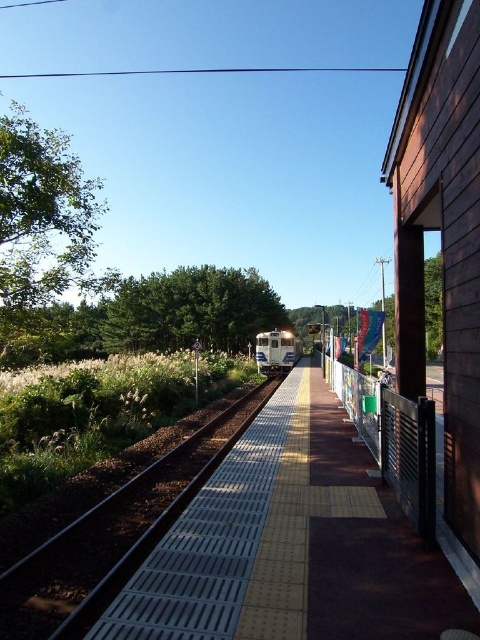
Between metallic silver train track at center and blue glossy train at center, which one has more height?

With more height is blue glossy train at center.

Who is more distant from viewer, (156, 506) or (262, 365)?

The point (262, 365) is behind.

Between point (187, 467) and point (284, 337), which one is positioned behind?

Point (284, 337)

Locate an element on the screen. The width and height of the screenshot is (480, 640). metallic silver train track at center is located at coordinates (115, 532).

Does point (253, 424) lie behind point (23, 630)?

That is True.

Who is shorter, yellow textured platform at center or metallic silver train track at center?

With less height is yellow textured platform at center.

Where is `yellow textured platform at center`? This screenshot has height=640, width=480. yellow textured platform at center is located at coordinates (290, 544).

Can you confirm if yellow textured platform at center is bigger than blue glossy train at center?

Actually, yellow textured platform at center might be smaller than blue glossy train at center.

Who is higher up, yellow textured platform at center or blue glossy train at center?

yellow textured platform at center

Is point (451, 589) closer to camera compared to point (264, 340)?

Yes, point (451, 589) is in front of point (264, 340).

Where is `yellow textured platform at center`? The width and height of the screenshot is (480, 640). yellow textured platform at center is located at coordinates [290, 544].